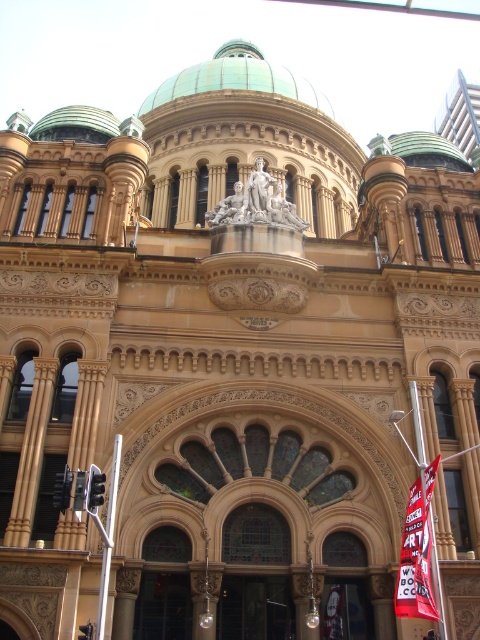
Is red fabric banner at lower right wider than green copper dome at upper center?

Incorrect, red fabric banner at lower right's width does not surpass green copper dome at upper center's.

Measure the distance between point (x=430, y=476) and camera.

→ Point (x=430, y=476) is 34.15 meters away from camera.

Locate an element on the screen. red fabric banner at lower right is located at coordinates click(x=417, y=552).